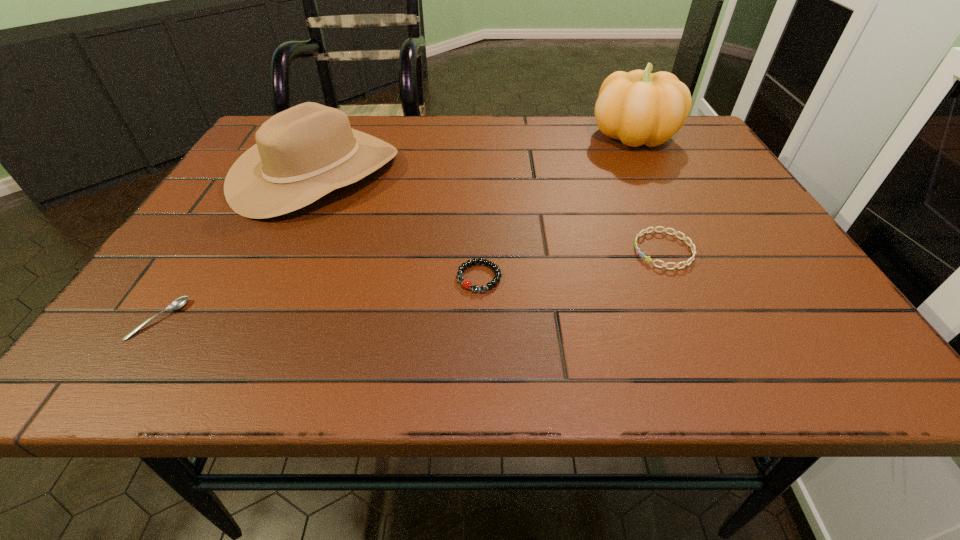
Identify the location of vacant space that satisfies the following two spatial constraints: 1. on the front side of the third object from left to right; 2. on the left side of the fourth shortest object. The image size is (960, 540). (266, 278).

Identify the location of vacant space that satisfies the following two spatial constraints: 1. on the front side of the tallest object; 2. on the surface of the right bracelet showing star-shaped elements. This screenshot has height=540, width=960. (691, 250).

Find the location of a particular element. This screenshot has width=960, height=540. free spot that satisfies the following two spatial constraints: 1. on the back side of the pumpkin; 2. on the left side of the left bracelet is located at coordinates (479, 134).